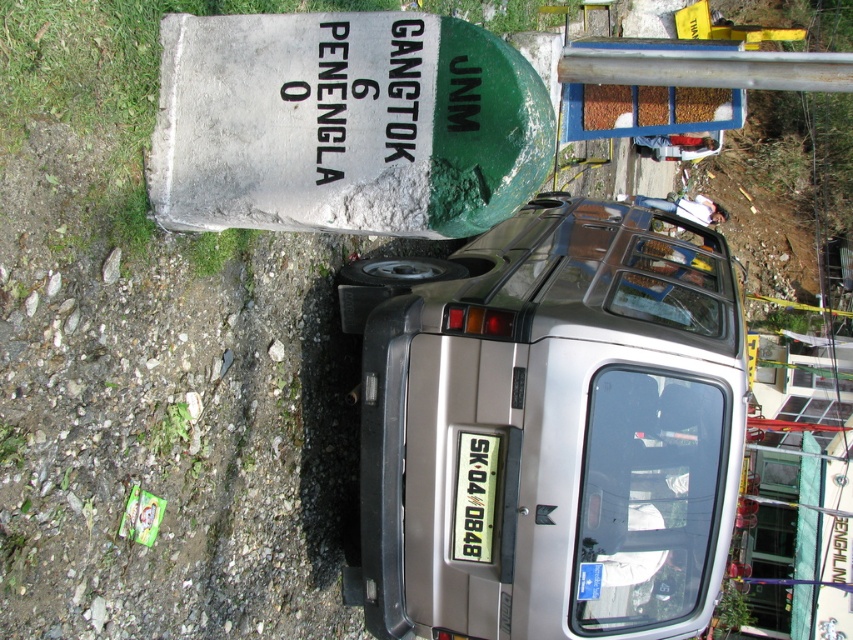
Which is more to the left, satin silver minivan at center or white plastic license plate at center?

From the viewer's perspective, white plastic license plate at center appears more on the left side.

Is point (506, 387) positioned before point (480, 486)?

Yes, point (506, 387) is in front of point (480, 486).

The width and height of the screenshot is (853, 640). What do you see at coordinates (554, 429) in the screenshot?
I see `satin silver minivan at center` at bounding box center [554, 429].

In order to click on satin silver minivan at center in this screenshot , I will do tap(554, 429).